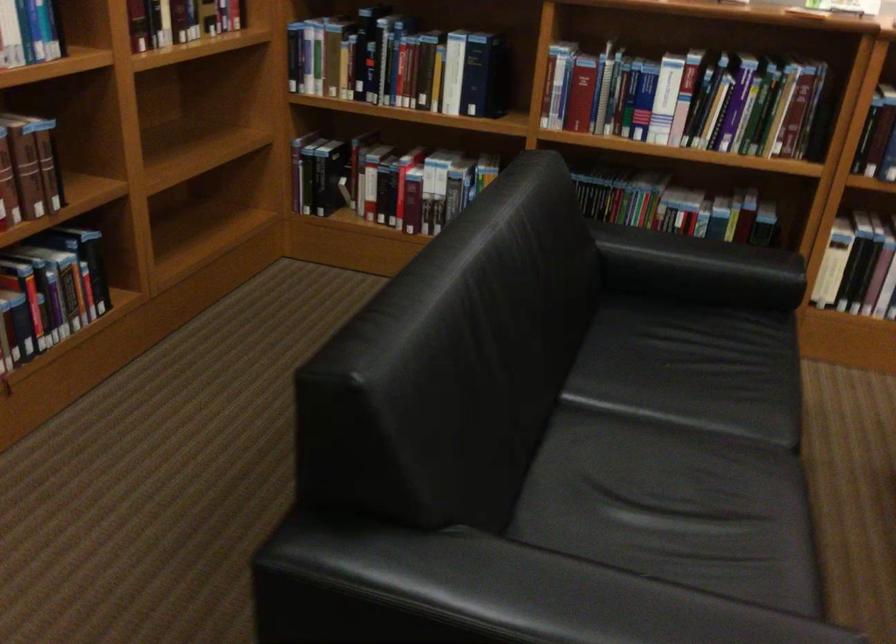
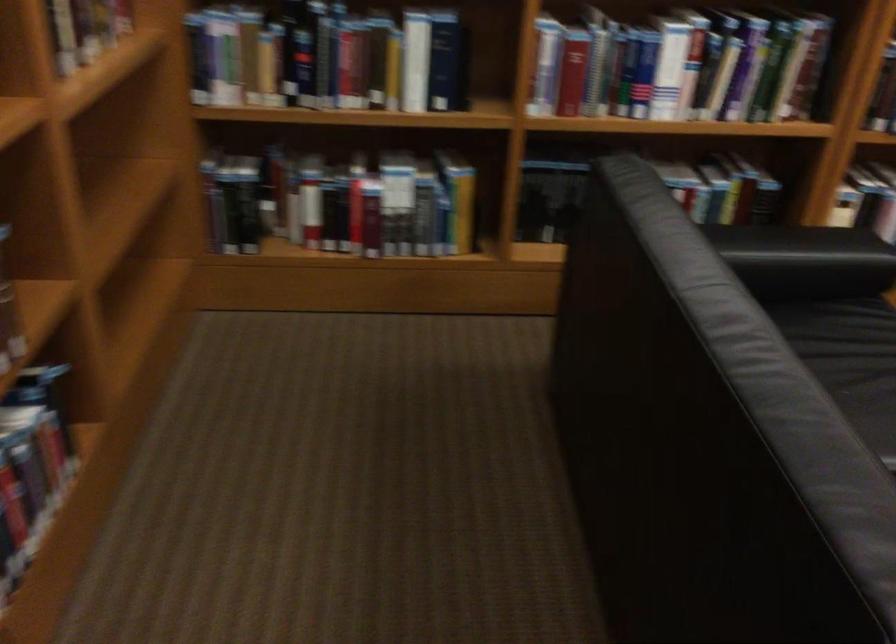
In a continuous first-person perspective shot, in which direction is the camera moving?

The cameraman moved toward left, forward.